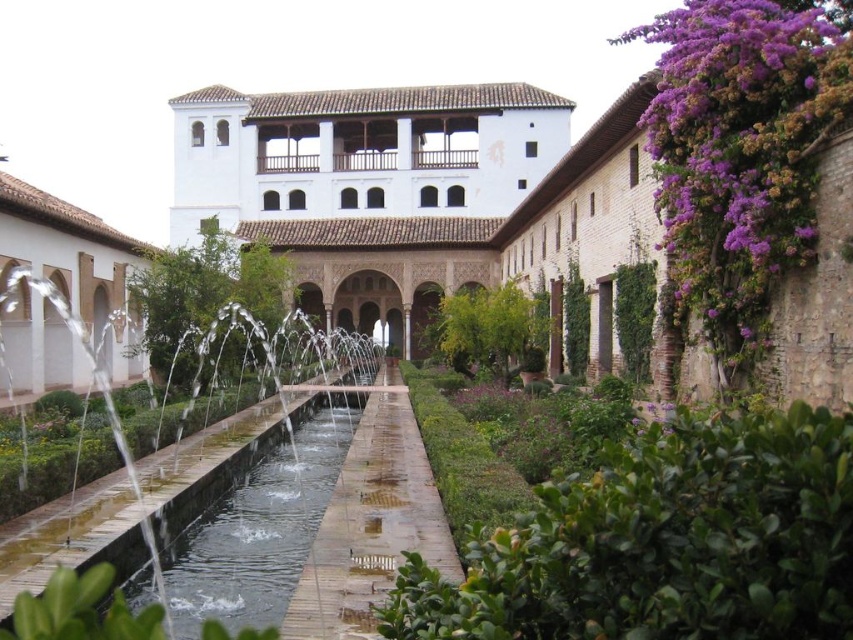
You are standing in the courtyard and want to pour a drink into the clear glass water at center. However, you notice the white stucco palace at left nearby. Considering their heights, will the water from the drink spill over the glass? Please explain.

The clear glass water at center has a lesser height compared to the white stucco palace at left. Since the palace is taller, pouring the drink into the glass water may cause the water level to rise, potentially spilling over if the glass is already filled to its maximum capacity.

You are standing in the courtyard and want to walk towards the white stucco palace at left. Which direction should you move relative to the green stone pathway at center?

To reach the white stucco palace at left, you should move to the left of the green stone pathway at center since the white stucco palace at left is positioned to the left of the green stone pathway at center.